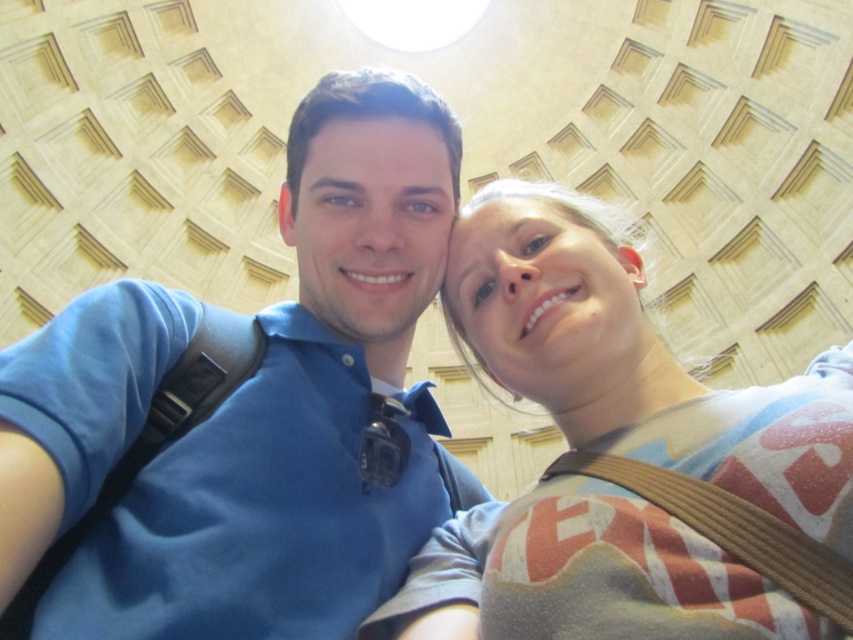
You are standing in front of the dome ceiling and see two people taking a selfie. The man is wearing a blue cotton shirt at center and the woman is wearing a light brown cotton shirt at center. Which one is positioned more to the left side?

The blue cotton shirt at center is positioned more to the left side than the light brown cotton shirt at center.

You are a photographer taking a picture of the blue cotton shirt at center and the light brown cotton shirt at center. Which shirt should you focus on first if you want to capture both shirts clearly in the same frame?

The blue cotton shirt at center has a greater height compared to the light brown cotton shirt at center, so you should focus on the blue cotton shirt at center first to ensure both shirts are in focus.